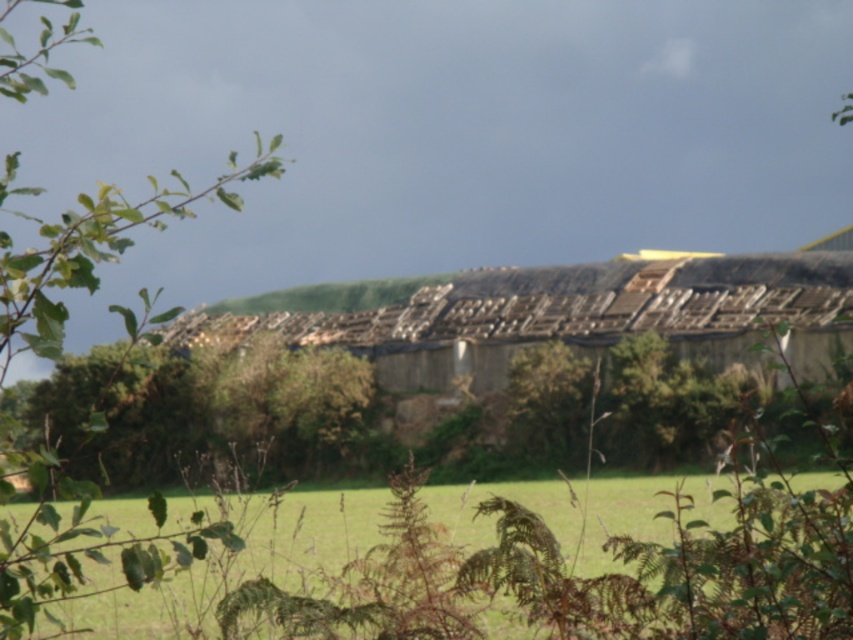
Does green grass at lower center have a greater height compared to green leafy branch at left?

In fact, green grass at lower center may be shorter than green leafy branch at left.

Is green grass at lower center wider than green leafy branch at left?

No, green grass at lower center is not wider than green leafy branch at left.

Between point (822, 632) and point (28, 296), which one is positioned behind?

The point (822, 632) is behind.

Identify the location of green grass at lower center. (558, 576).